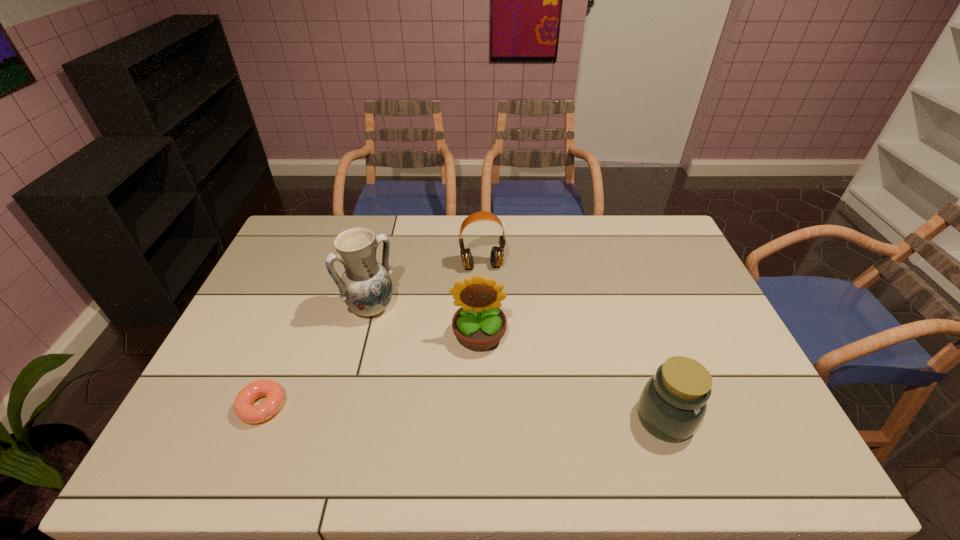
Find the location of a particular element. Image resolution: width=960 pixels, height=540 pixels. object that is at the near left corner is located at coordinates (x=243, y=406).

Locate an element on the screen. free space at the far edge of the desktop is located at coordinates (528, 238).

In the image, there is a desktop. Where is `vacant space at the near edge`? The width and height of the screenshot is (960, 540). vacant space at the near edge is located at coordinates (358, 407).

This screenshot has width=960, height=540. Identify the location of vacant space at the left edge. (265, 378).

You are a GUI agent. You are given a task and a screenshot of the screen. Output one action in this format:
    pyautogui.click(x=<x>, y=<y>)
    Task: Click on the vacant area at the right edge
    
    Given the screenshot: What is the action you would take?
    pyautogui.click(x=723, y=348)

This screenshot has width=960, height=540. I want to click on vacant region at the near left corner of the desktop, so click(200, 421).

I want to click on vacant space at the far right corner, so click(678, 248).

Identify the location of free spot between the headset and the rightmost object. This screenshot has width=960, height=540. (573, 342).

Find the location of a particular element. Image resolution: width=960 pixels, height=540 pixels. free space between the jar and the headset is located at coordinates (573, 342).

At what (x,y) coordinates should I click in order to perform the action: click on free area in between the leftmost object and the headset. Please return your answer as a coordinate pair (x, y). Looking at the image, I should click on (372, 336).